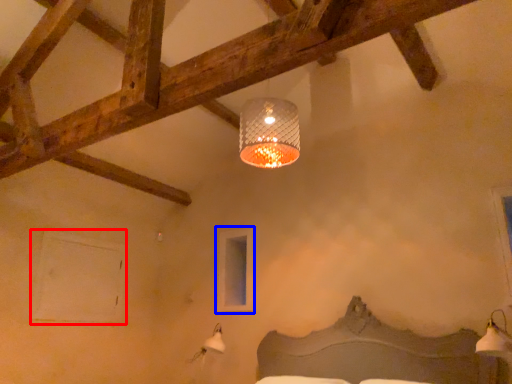
Question: Which object is closer to the camera taking this photo, window (highlighted by a red box) or window (highlighted by a blue box)?

Choices:
 (A) window
 (B) window

Answer: (A)